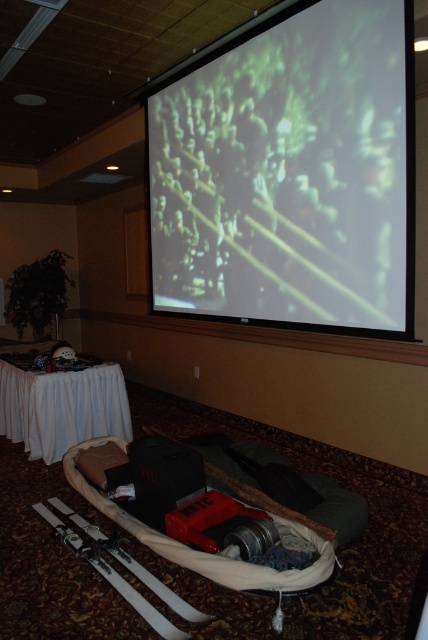
You are an attendee at a presentation and want to take notes. You have a notebook on the white cloth table at lower left and need to look at the matte white screen at upper center. Can you see the screen without moving your notebook?

The matte white screen at upper center is above the white cloth table at lower left, so you can see the screen while keeping your notebook on the white cloth table at lower left without needing to move it.

You are an event organizer who needs to adjust the seating arrangement. The room has a matte white screen at upper center and a white cloth table at lower left. Which object is taller?

The matte white screen at upper center is much taller than the white cloth table at lower left.